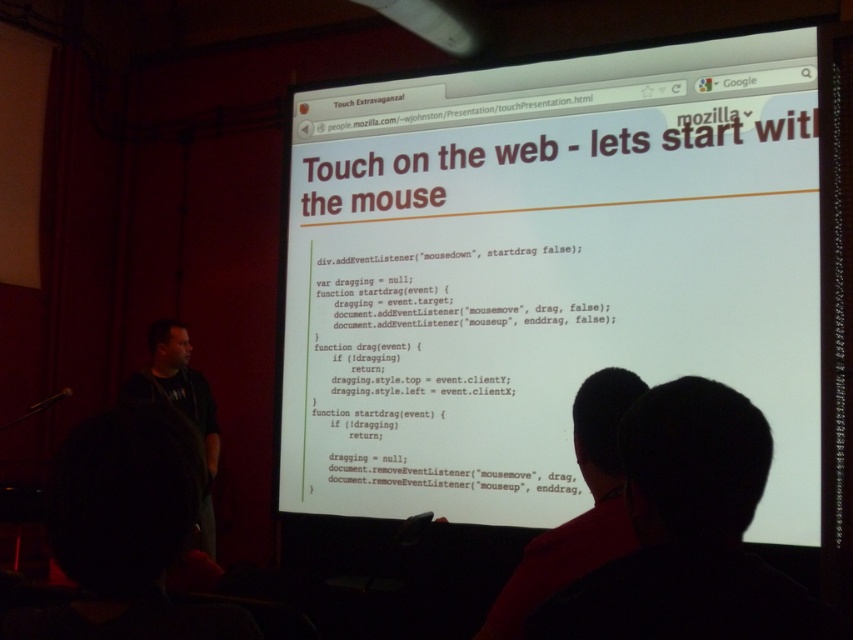
Question: Does white paper at center have a larger size compared to black hair at upper center?

Choices:
 (A) yes
 (B) no

Answer: (A)

Question: Does black hair at upper right come behind dark gray shirt at left?

Choices:
 (A) no
 (B) yes

Answer: (A)

Question: Which point appears closest to the camera in this image?

Choices:
 (A) 555,445
 (B) 634,394
 (C) 752,468

Answer: (C)

Question: Among these objects, which one is farthest from the camera?

Choices:
 (A) black hair at upper right
 (B) dark gray shirt at left
 (C) white paper at center
 (D) black hair at upper center

Answer: (B)

Question: Which of the following is the farthest from the observer?

Choices:
 (A) black hair at upper center
 (B) white paper at center
 (C) dark gray shirt at left
 (D) black hair at upper right

Answer: (C)

Question: Can you confirm if white paper at center is positioned below black hair at upper right?

Choices:
 (A) yes
 (B) no

Answer: (B)